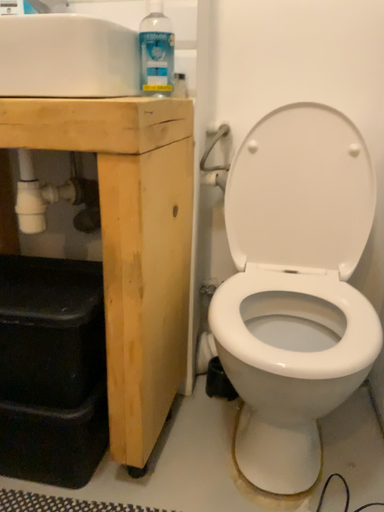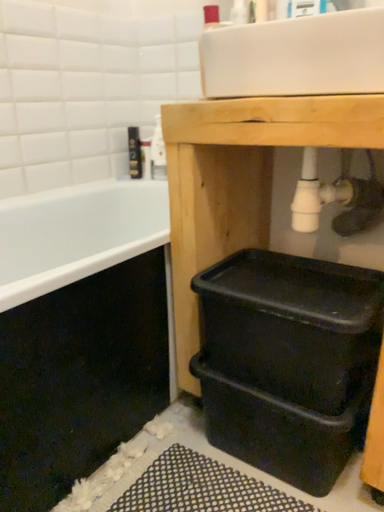
Question: How did the camera likely rotate when shooting the video?

Choices:
 (A) rotated left
 (B) rotated right

Answer: (A)